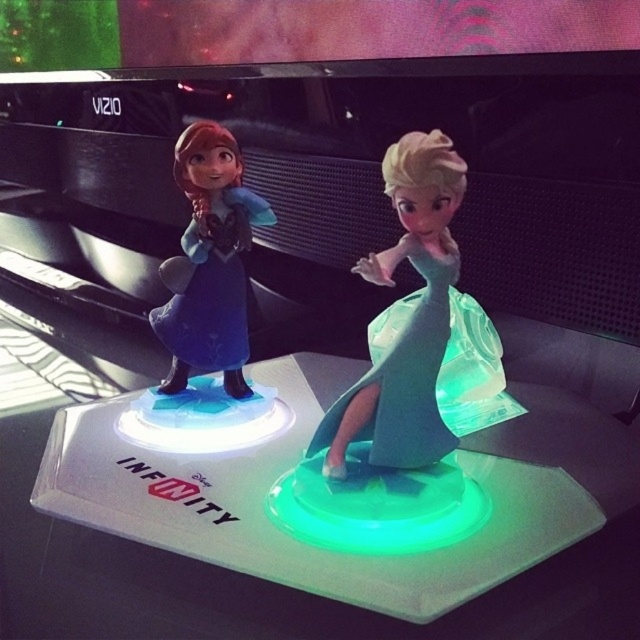
You are examining the Disney Infinity base with the Frozen figurines. The base has a glowing area at the center. There is a translucent green dress at center and another object nearby. Which object is positioned closer to the center of the base?

The translucent green dress at center is located at point (x=404, y=380), which is closer to the center of the base compared to the other object mentioned.

Consider the image. You are a collector who wants to display the two Disney Infinity figurines from Frozen. You notice the translucent green dress at center and the matte blue dress at left. Which figurine has a narrower dress?

The translucent green dress at center is thinner than the matte blue dress at left, so the figurine with the translucent green dress at center has a narrower dress.

You are organizing a display of Disney Infinity figurines. You have a translucent green dress at center and a matte blue dress at left. Which dress is positioned closer to the right edge of the base?

The translucent green dress at center is positioned closer to the right edge of the base than the matte blue dress at left.